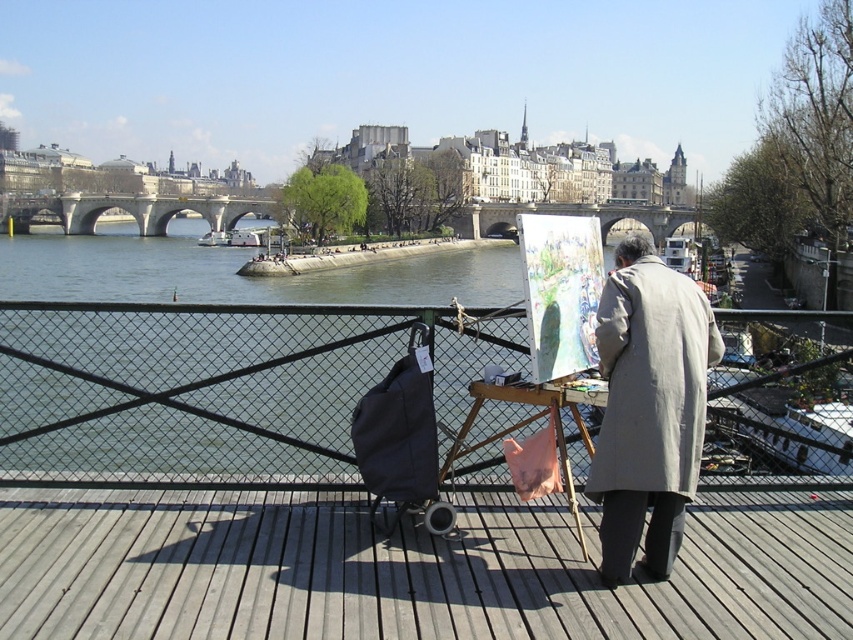
You are an artist who just arrived at the riverside and want to set up your easel. You notice the metal fence at center and the wooden easel at center. Which object is blocking your view of the other?

The metal fence at center is positioned over wooden easel at center, so the metal fence at center is blocking the view of the wooden easel at center.